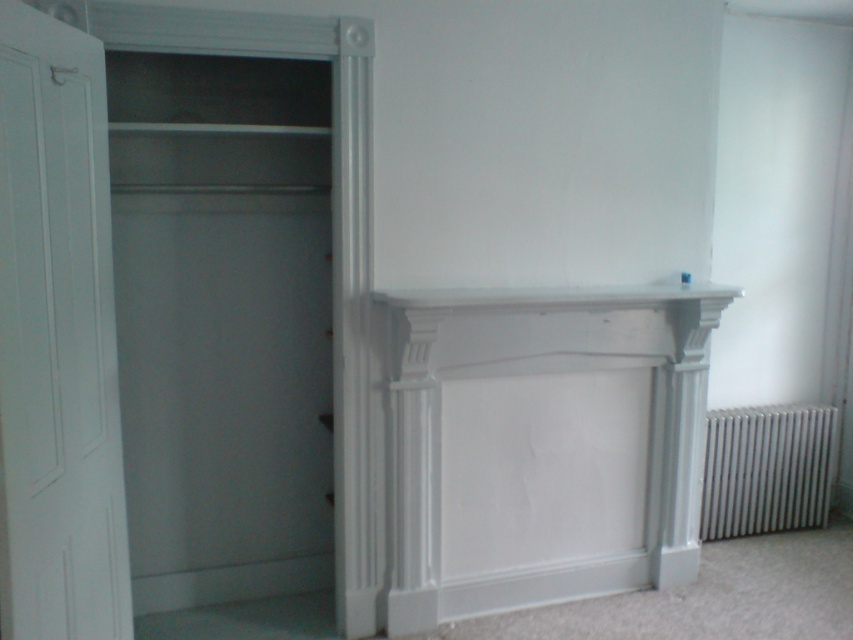
You are moving a large painting that is 1.5 meters wide. You want to place it on the wall between the matte white closet at left and the white metallic radiator at lower right. Is there enough space between them to fit the painting?

The matte white closet at left is to the left of white metallic radiator at lower right, so the distance between them is sufficient to accommodate a painting that is 1.5 meters wide.

You are moving a large painting that is 1.5 meters wide. You want to place it on either the matte white closet at left or the white smooth mantle at center. Based on their sizes, which location can accommodate the painting without it overhanging?

The matte white closet at left is bigger than the white smooth mantle at center, so the painting can be placed on the matte white closet at left without overhanging.